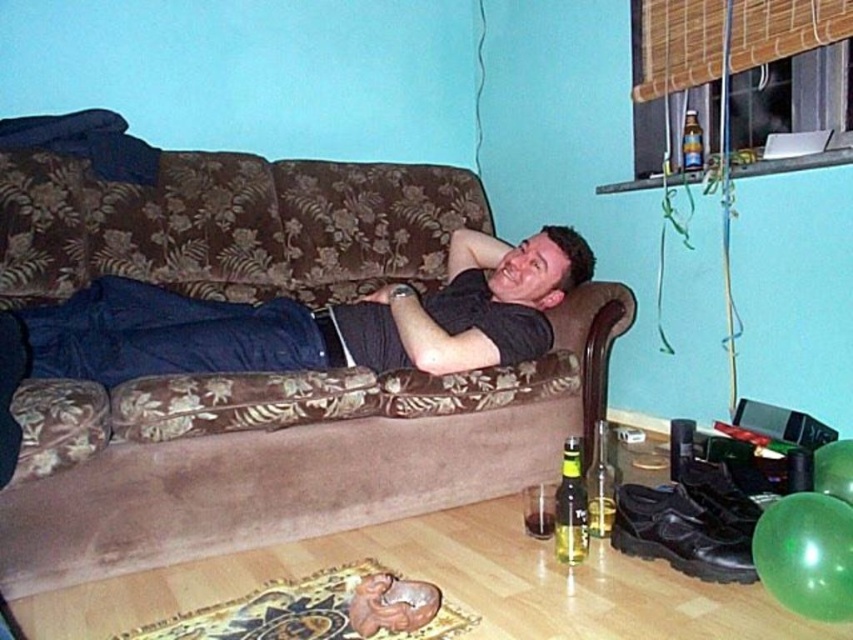
Between green glass bottle at lower center and translucent glass bottle at upper right, which one is positioned higher?

translucent glass bottle at upper right

Who is lower down, green glass bottle at lower center or translucent glass bottle at upper right?

green glass bottle at lower center is lower down.

Is point (575, 474) positioned before point (697, 134)?

Yes, it is.

This screenshot has width=853, height=640. I want to click on green glass bottle at lower center, so click(x=570, y=506).

Which is above, brown floral fabric couch at center or green glass bottle at lower center?

brown floral fabric couch at center is above.

Is brown floral fabric couch at center bigger than green glass bottle at lower center?

Yes, brown floral fabric couch at center is bigger than green glass bottle at lower center.

Describe the element at coordinates (282, 452) in the screenshot. The width and height of the screenshot is (853, 640). I see `brown floral fabric couch at center` at that location.

Locate an element on the screen. The width and height of the screenshot is (853, 640). brown floral fabric couch at center is located at coordinates (282, 452).

Which of these two, black matte shirt at center or green glass bottle at lower center, stands shorter?

green glass bottle at lower center is shorter.

From the picture: Can you confirm if black matte shirt at center is wider than green glass bottle at lower center?

Yes, black matte shirt at center is wider than green glass bottle at lower center.

Image resolution: width=853 pixels, height=640 pixels. What do you see at coordinates (320, 321) in the screenshot? I see `black matte shirt at center` at bounding box center [320, 321].

Where is `black matte shirt at center`? This screenshot has width=853, height=640. black matte shirt at center is located at coordinates (320, 321).